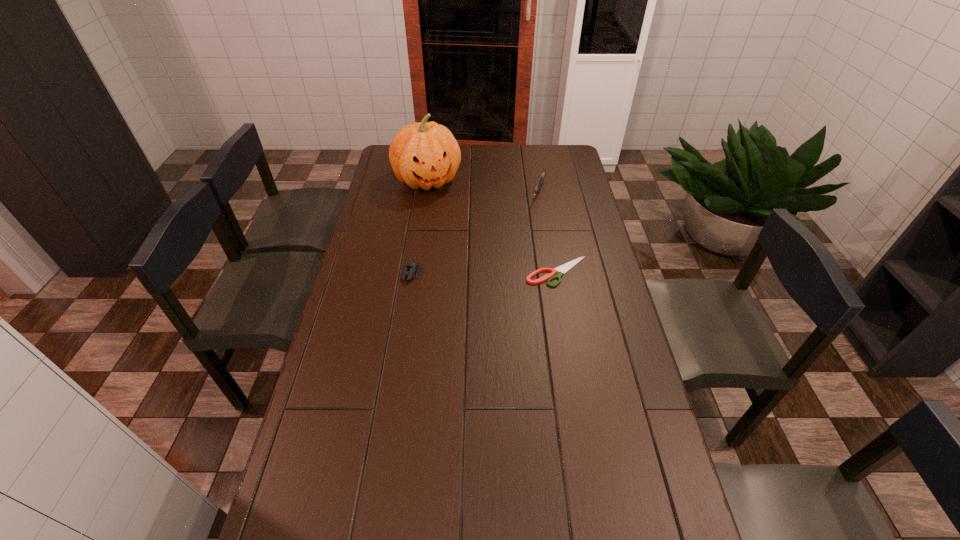
This screenshot has width=960, height=540. In order to click on blank space at the near right corner of the desktop in this screenshot , I will do `click(669, 532)`.

Where is `empty space between the second tallest object and the pumpkin`? This screenshot has width=960, height=540. empty space between the second tallest object and the pumpkin is located at coordinates (483, 187).

The image size is (960, 540). Find the location of `free space between the shortest object and the third tallest object`. free space between the shortest object and the third tallest object is located at coordinates (484, 273).

Locate an element on the screen. This screenshot has height=540, width=960. unoccupied area between the computer mouse and the gun is located at coordinates (474, 233).

Locate an element on the screen. The height and width of the screenshot is (540, 960). vacant space in between the shortest object and the second shortest object is located at coordinates (484, 273).

You are a GUI agent. You are given a task and a screenshot of the screen. Output one action in this format:
    pyautogui.click(x=<x>, y=<y>)
    Task: Click on the free space that is in between the computer mouse and the gun
    This screenshot has height=540, width=960.
    Given the screenshot: What is the action you would take?
    pyautogui.click(x=474, y=233)

I want to click on free space between the shortest object and the tallest object, so click(x=492, y=226).

The height and width of the screenshot is (540, 960). Find the location of `free space between the third tallest object and the shortest object`. free space between the third tallest object and the shortest object is located at coordinates (484, 273).

This screenshot has width=960, height=540. Identify the location of vacant area between the third shortest object and the pumpkin. (483, 187).

Find the location of a particular element. This screenshot has width=960, height=540. vacant space in between the tallest object and the scissors is located at coordinates (492, 226).